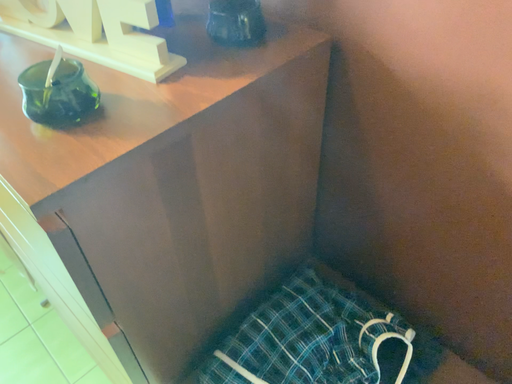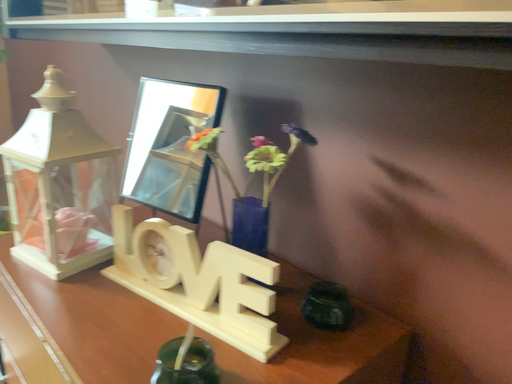
Question: Which way did the camera rotate in the video?

Choices:
 (A) rotated downward
 (B) rotated upward

Answer: (B)